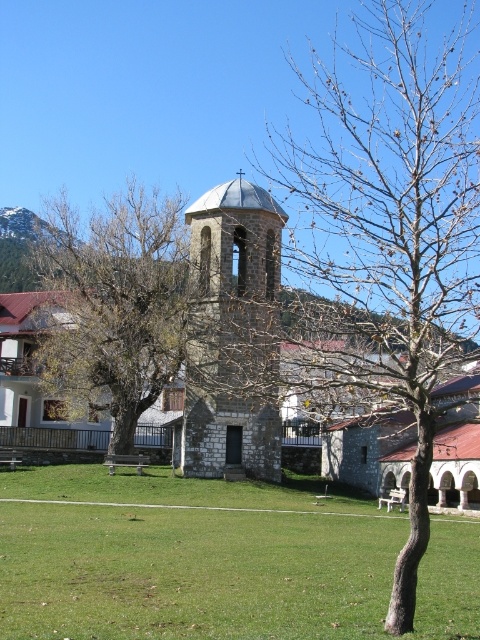
You are standing in the grassy area and want to walk towards the bell tower. Which tree, the bare branches at center or the brown leafy tree at center, would you pass first?

The bare branches at center is closer to the viewer than the brown leafy tree at center, so you would pass the bare branches at center first on your way to the bell tower.

You are standing in the grassy area and want to walk directly to the stone bell tower at center. Which direction should you walk relative to the brown leafy tree at center?

You should walk to the right of the brown leafy tree at center to reach the stone bell tower at center because the brown leafy tree at center is to the left of stone bell tower at center.